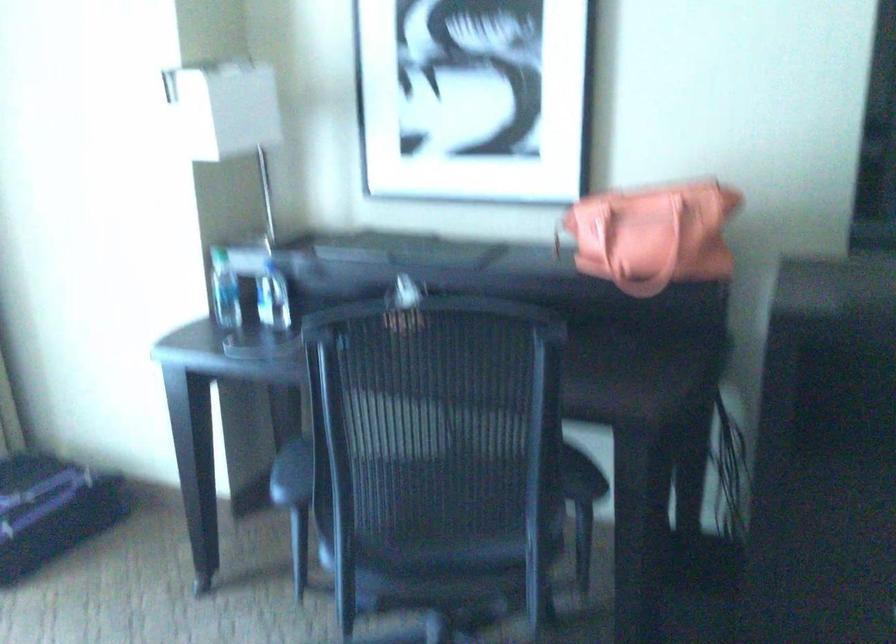
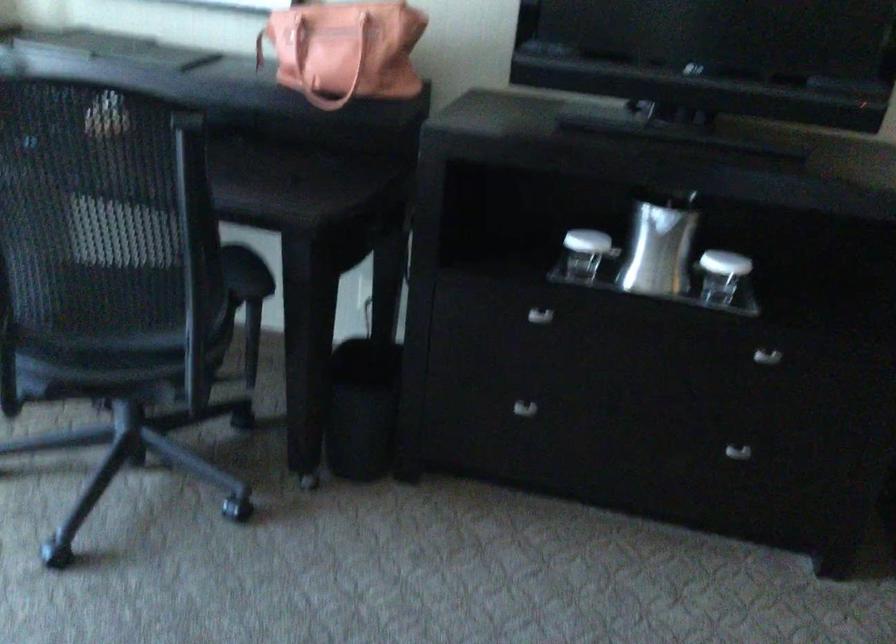
Find the pixel in the second image that matches pixel 623 236 in the first image.

(315, 57)